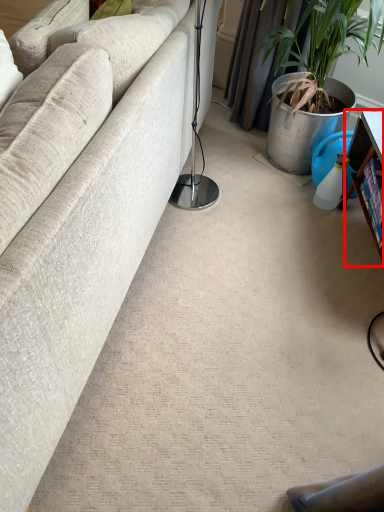
Question: Where is table (annotated by the red box) located in relation to studio couch in the image?

Choices:
 (A) left
 (B) right

Answer: (B)